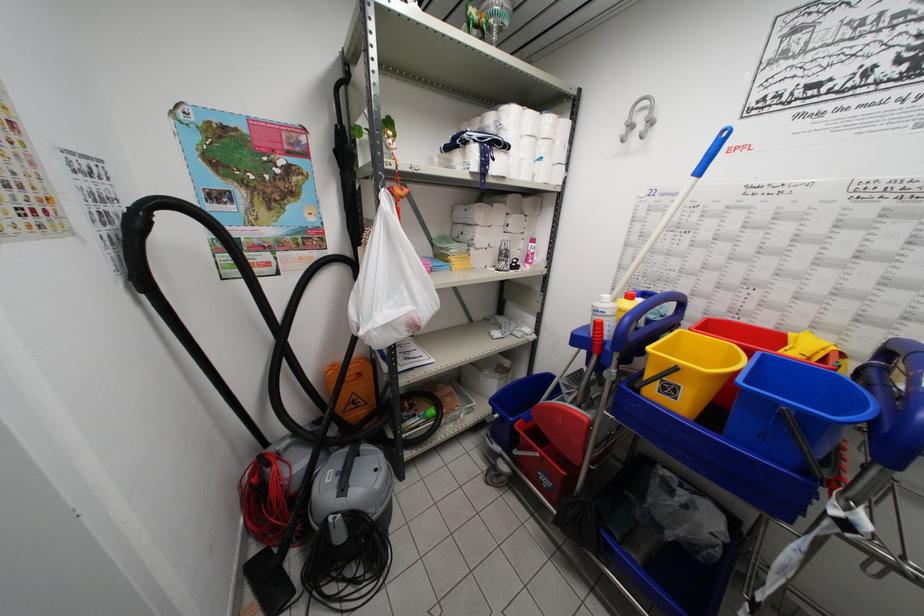
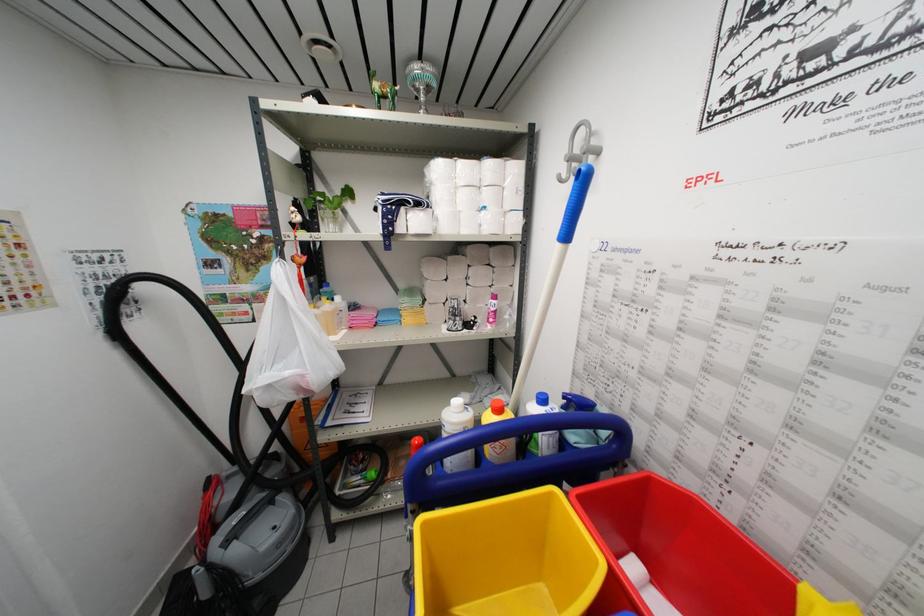
Where in the second image is the point corresponding to (x=512, y=268) from the first image?

(459, 326)